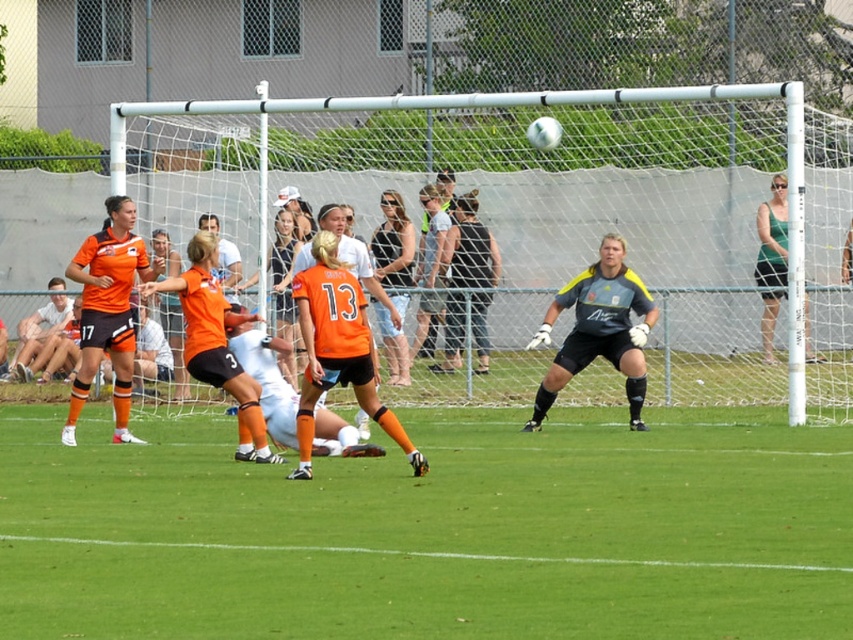
Question: From the image, what is the correct spatial relationship of green grass at center in relation to white mesh netting at center?

Choices:
 (A) right
 (B) left

Answer: (B)

Question: Does green grass at center have a larger size compared to white mesh netting at center?

Choices:
 (A) yes
 (B) no

Answer: (B)

Question: Which object is positioned farthest from the orange matte jersey at left?

Choices:
 (A) white mesh netting at center
 (B) green grass at center
 (C) green fabric tank top at upper right

Answer: (C)

Question: Is the position of green grass at center less distant than that of orange matte jersey at left?

Choices:
 (A) yes
 (B) no

Answer: (A)

Question: Which object is positioned farthest from the green fabric tank top at upper right?

Choices:
 (A) gray-yellow jersey at center
 (B) white mesh netting at center

Answer: (A)

Question: Estimate the real-world distances between objects in this image. Which object is farther from the white mesh netting at center?

Choices:
 (A) green grass at center
 (B) orange matte jersey at left

Answer: (A)